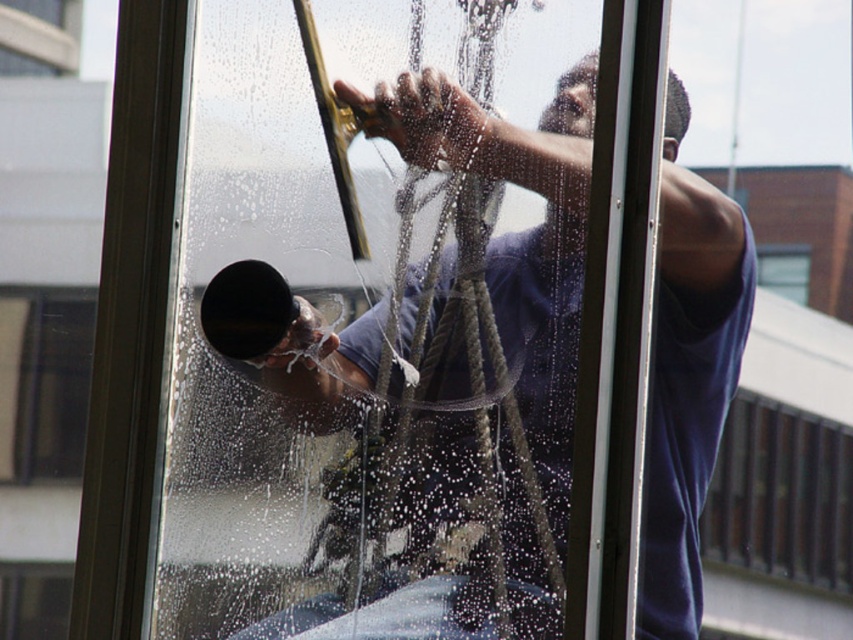
You are inside a high rise building and want to clean a window. You have two points marked on the window surface. The first point is at coordinates point [354,339] and the second point is at point [759,246]. Which point is closer to you?

Point [354,339] is closer to you than point [759,246].

You are an inspector checking the window cleaning process. You notice the dark blue shirt at center and the transparent glass window at upper center. Which object takes up more space in your view?

The dark blue shirt at center is larger in size than the transparent glass window at upper center, so the dark blue shirt at center takes up more space in your view.